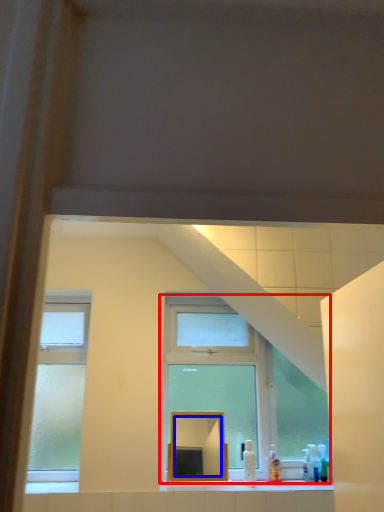
Question: Which object is further to the camera taking this photo, window (highlighted by a red box) or mirror (highlighted by a blue box)?

Choices:
 (A) window
 (B) mirror

Answer: (A)